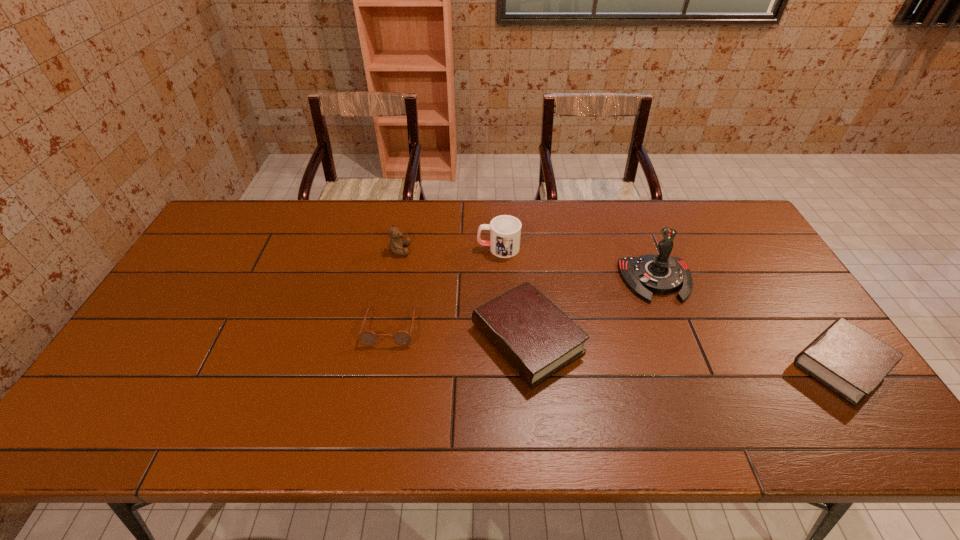
Locate an element on the screen. The image size is (960, 540). vacant space located on the back of the right Bible is located at coordinates (789, 288).

The width and height of the screenshot is (960, 540). What are the coordinates of `free region located on the handle side of the tallest object` in the screenshot? It's located at (695, 377).

Where is `blank space located 0.150m on the front-facing side of the teddy bear`? This screenshot has width=960, height=540. blank space located 0.150m on the front-facing side of the teddy bear is located at coordinates (457, 250).

Find the location of a particular element. The height and width of the screenshot is (540, 960). vacant space located on the front-facing side of the spectacles is located at coordinates (381, 374).

The width and height of the screenshot is (960, 540). Identify the location of vacant space located on the side of the mug with the handle. (x=396, y=248).

Identify the location of free point located 0.230m on the side of the mug with the handle. Image resolution: width=960 pixels, height=540 pixels. (406, 248).

I want to click on vacant region located 0.050m on the side of the mug with the handle, so click(462, 248).

Find the location of a particular element. This screenshot has height=540, width=960. teddy bear that is at the far edge is located at coordinates (396, 245).

Identify the location of mug located in the far edge section of the desktop. (505, 231).

I want to click on object situated at the right edge, so click(851, 362).